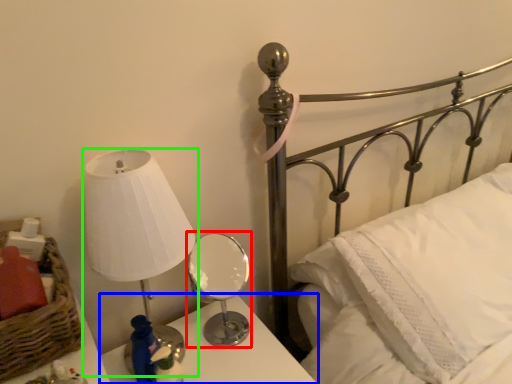
Question: Which is farther away from table lamp (highlighted by a red box)? nightstand (highlighted by a blue box) or lamp (highlighted by a green box)?

Choices:
 (A) nightstand
 (B) lamp

Answer: (B)